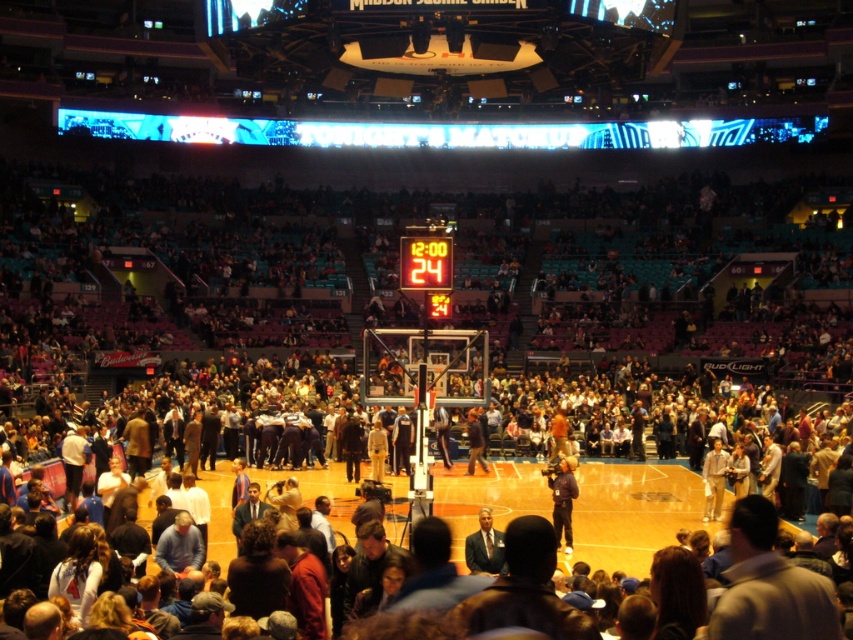
Question: Among these objects, which one is farthest from the camera?

Choices:
 (A) dark blue jacket at center
 (B) orange digital scoreboard at center

Answer: (B)

Question: Can you confirm if orange digital scoreboard at center is bigger than dark blue jacket at center?

Choices:
 (A) no
 (B) yes

Answer: (A)

Question: Among these points, which one is farthest from the camera?

Choices:
 (A) (561, 474)
 (B) (426, 280)

Answer: (B)

Question: Which point is farther from the camera taking this photo?

Choices:
 (A) (556, 492)
 (B) (445, 284)

Answer: (B)

Question: Does orange digital scoreboard at center have a larger size compared to dark blue jacket at center?

Choices:
 (A) no
 (B) yes

Answer: (A)

Question: Is orange digital scoreboard at center to the left of dark blue jacket at center from the viewer's perspective?

Choices:
 (A) no
 (B) yes

Answer: (B)